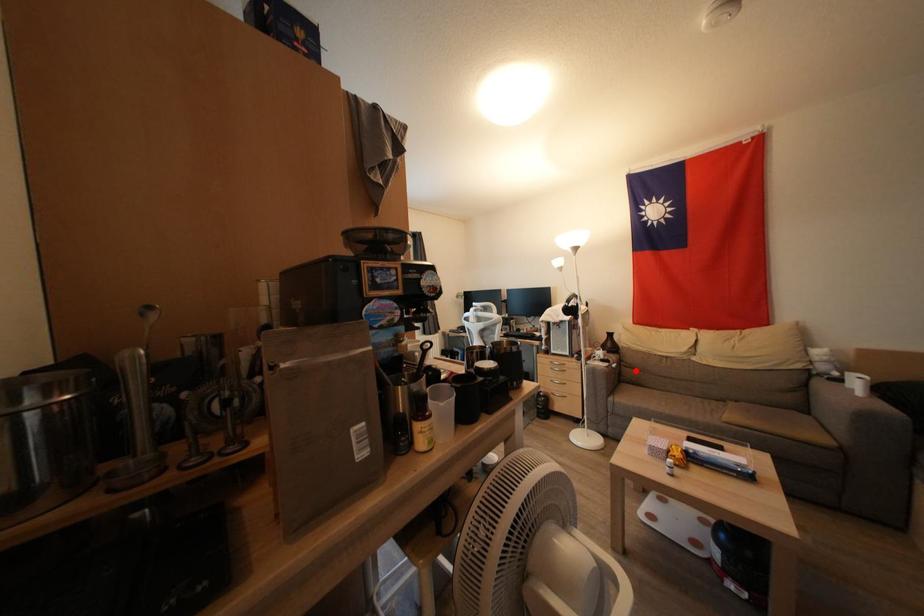
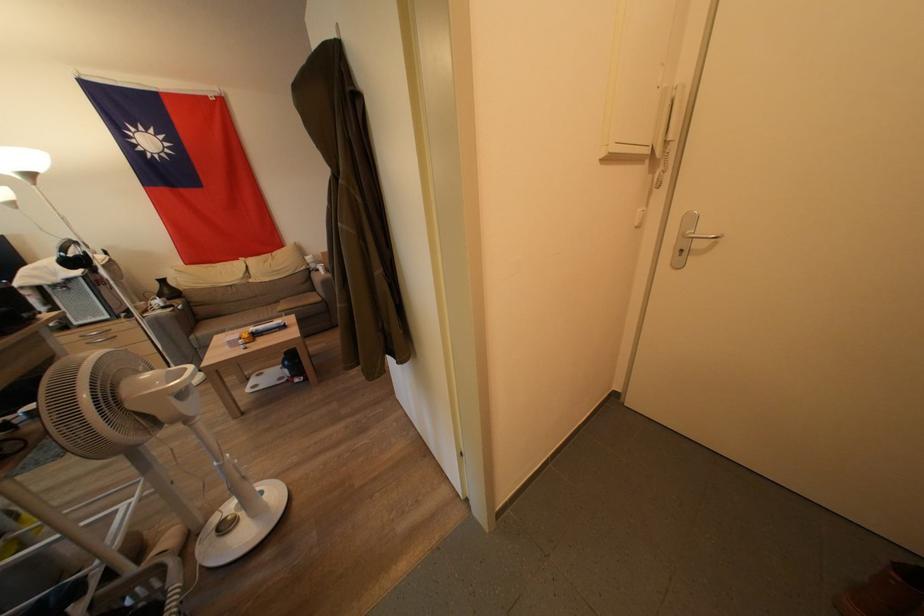
Where in the second image is the point corresponding to the highlighted location from the first image?

(207, 309)